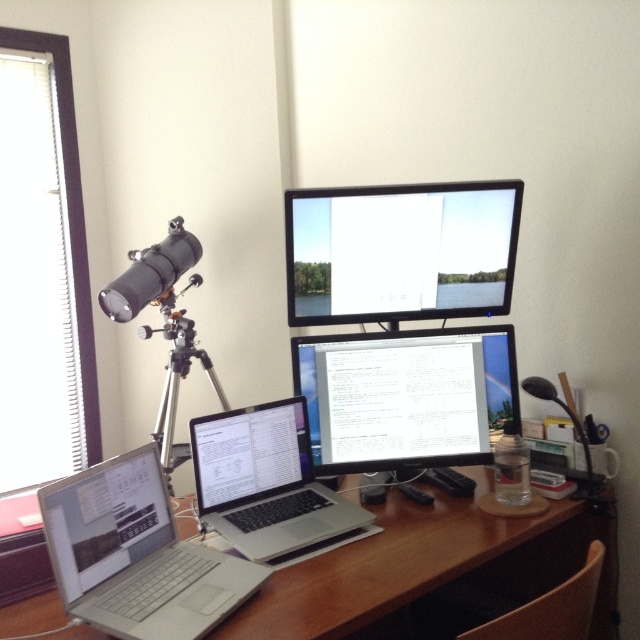
Question: Among these points, which one is nearest to the camera?

Choices:
 (A) (433, 188)
 (B) (104, 540)
 (C) (536, 518)
 (D) (323, 548)

Answer: (B)

Question: Among these objects, which one is nearest to the camera?

Choices:
 (A) wooden at center
 (B) matte black monitor at center

Answer: (A)

Question: Which object appears farthest from the camera in this image?

Choices:
 (A) matte black monitor at center
 (B) silver metallic laptop at center
 (C) wooden at center
 (D) silver metallic laptop at lower left

Answer: (A)

Question: In this image, where is matte black monitor at upper center located relative to matte black monitor at center?

Choices:
 (A) right
 (B) left

Answer: (B)

Question: Does silver metallic laptop at lower left have a larger size compared to silver metallic laptop at center?

Choices:
 (A) yes
 (B) no

Answer: (B)

Question: Is wooden at center wider than silver metallic laptop at center?

Choices:
 (A) yes
 (B) no

Answer: (A)